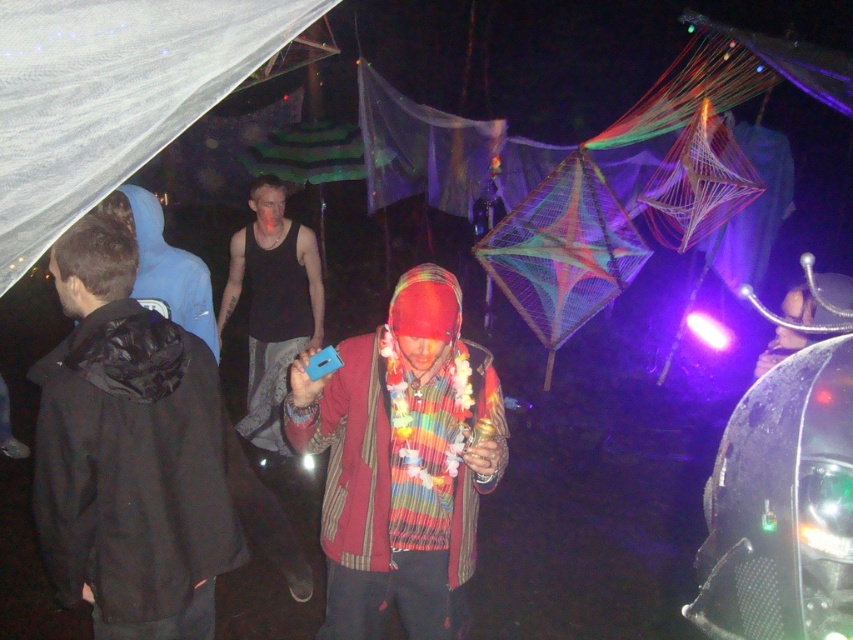
You are a photographer trying to capture the person in the scene. Since the black matte jacket at center and the striped fabric scarf at center are both important elements, which one should you focus on to ensure they are in the frame first?

The black matte jacket at center is taller than the striped fabric scarf at center, so focusing on the black matte jacket at center first will ensure both elements are in the frame.

You are a photographer trying to capture the black matte jacket at center and the striped fabric scarf at center in a single shot. Which object will appear closer to the camera in the photo?

The black matte jacket at center will appear closer to the camera because it is further to the viewer than the striped fabric scarf at center.

You are at a nighttime festival and see a person wearing a striped fabric scarf at center and a black tank top at center. Which clothing item is narrower?

The striped fabric scarf at center is narrower than the black tank top at center.